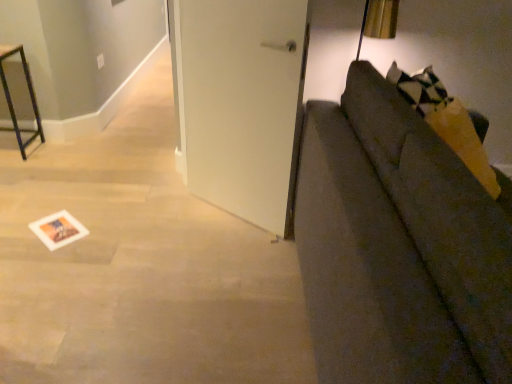
This screenshot has height=384, width=512. Find the location of `vacant area that lies to the right of white paper postcard at lower left`. vacant area that lies to the right of white paper postcard at lower left is located at coordinates (100, 231).